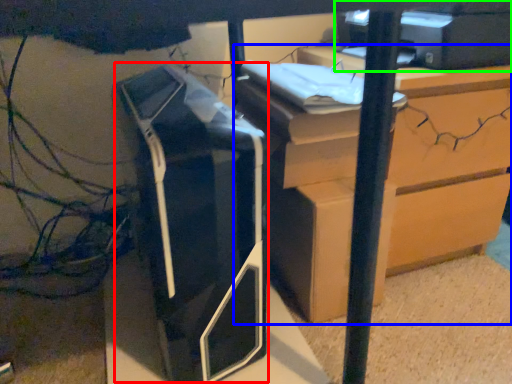
Question: Considering the real-world distances, which object is farthest from printer (highlighted by a red box)? chest of drawers (highlighted by a blue box) or printer (highlighted by a green box)?

Choices:
 (A) chest of drawers
 (B) printer

Answer: (B)